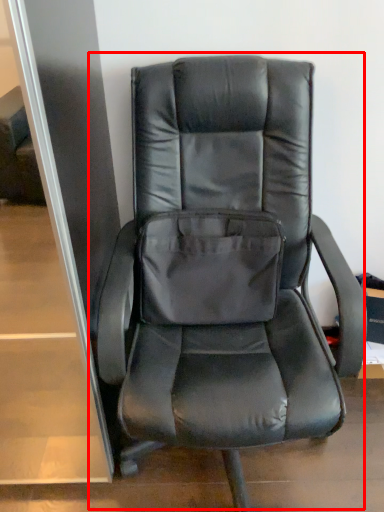
Question: From the image's perspective, where is chair (annotated by the red box) located relative to pocket?

Choices:
 (A) above
 (B) below

Answer: (B)